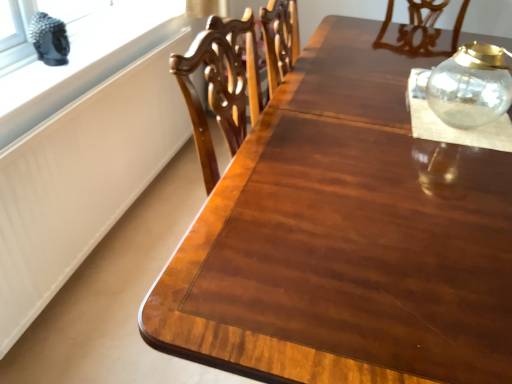
Identify the location of vacant space underneath transparent glass jar at upper right (from a real-world perspective). Image resolution: width=512 pixels, height=384 pixels. (442, 112).